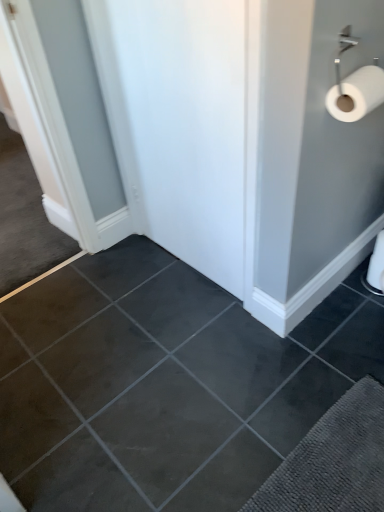
Describe the element at coordinates (357, 94) in the screenshot. I see `white matte toilet paper at upper right` at that location.

Image resolution: width=384 pixels, height=512 pixels. I want to click on white matte toilet paper at upper right, so pyautogui.click(x=357, y=94).

Locate an element on the screen. Image resolution: width=384 pixels, height=512 pixels. white matte toilet paper at upper right is located at coordinates (357, 94).